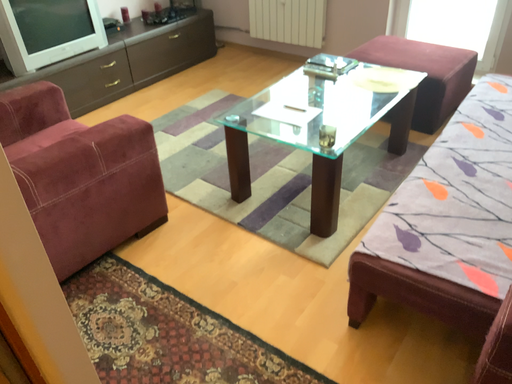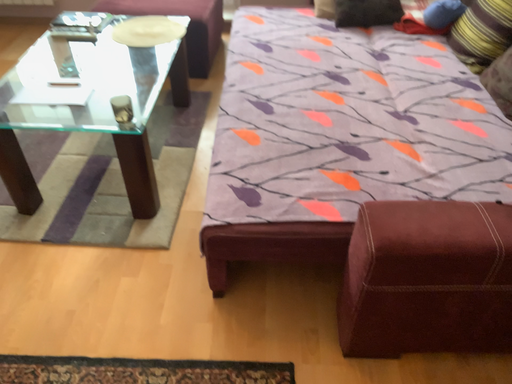
Question: How did the camera likely rotate when shooting the video?

Choices:
 (A) rotated right
 (B) rotated left

Answer: (A)